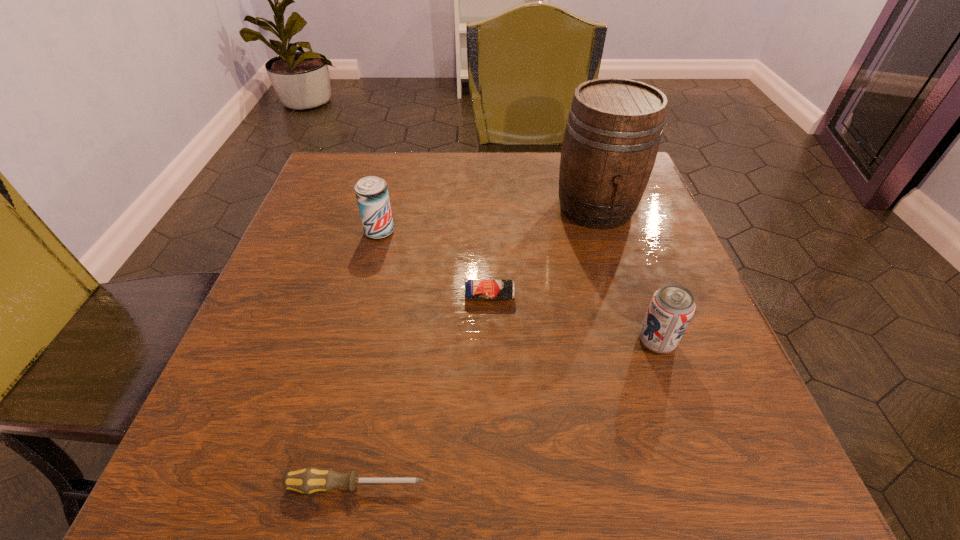
In order to click on the tallest object in this screenshot , I will do tap(613, 131).

Find the location of a particular element. the farthest beer can is located at coordinates (371, 192).

The width and height of the screenshot is (960, 540). I want to click on the nearest beer can, so click(x=671, y=308).

At what (x,y) coordinates should I click in order to perform the action: click on the fourth farthest object. Please return your answer as a coordinate pair (x, y). Image resolution: width=960 pixels, height=540 pixels. Looking at the image, I should click on (671, 308).

The width and height of the screenshot is (960, 540). I want to click on the third farthest object, so click(x=473, y=289).

Image resolution: width=960 pixels, height=540 pixels. What are the coordinates of `the shortest beer can` in the screenshot? It's located at (473, 289).

You are a GUI agent. You are given a task and a screenshot of the screen. Output one action in this format:
    pyautogui.click(x=<x>, y=<y>)
    Task: Click on the nearest object
    
    Given the screenshot: What is the action you would take?
    pyautogui.click(x=308, y=480)

I want to click on blank space located 0.370m on the side of the cider near the bung hole, so click(653, 392).

Where is `free location located 0.080m on the right of the leftmost beer can`? The image size is (960, 540). free location located 0.080m on the right of the leftmost beer can is located at coordinates (432, 232).

The height and width of the screenshot is (540, 960). I want to click on free region located 0.370m on the back of the rightmost beer can, so click(x=608, y=200).